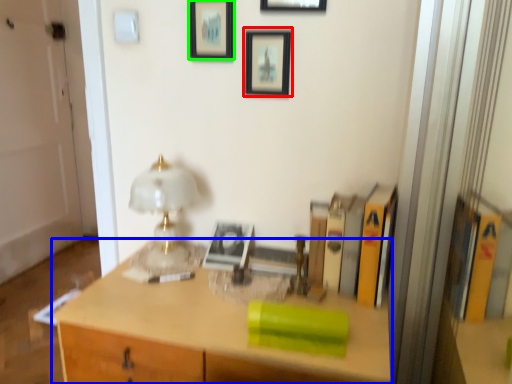
Question: Which object is the closest to the picture frame (highlighted by a red box)? Choose among these: desk (highlighted by a blue box) or picture frame (highlighted by a green box).

Choices:
 (A) desk
 (B) picture frame

Answer: (B)